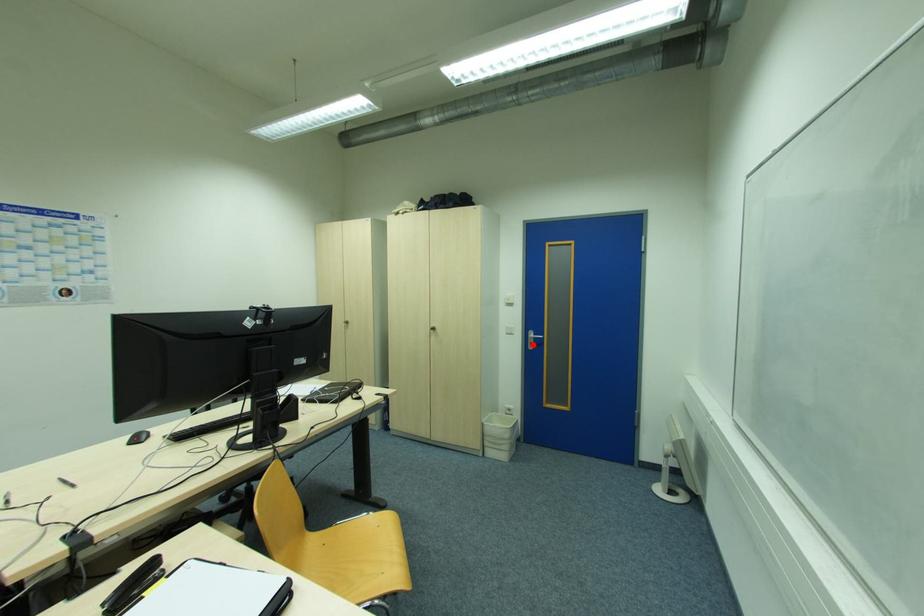
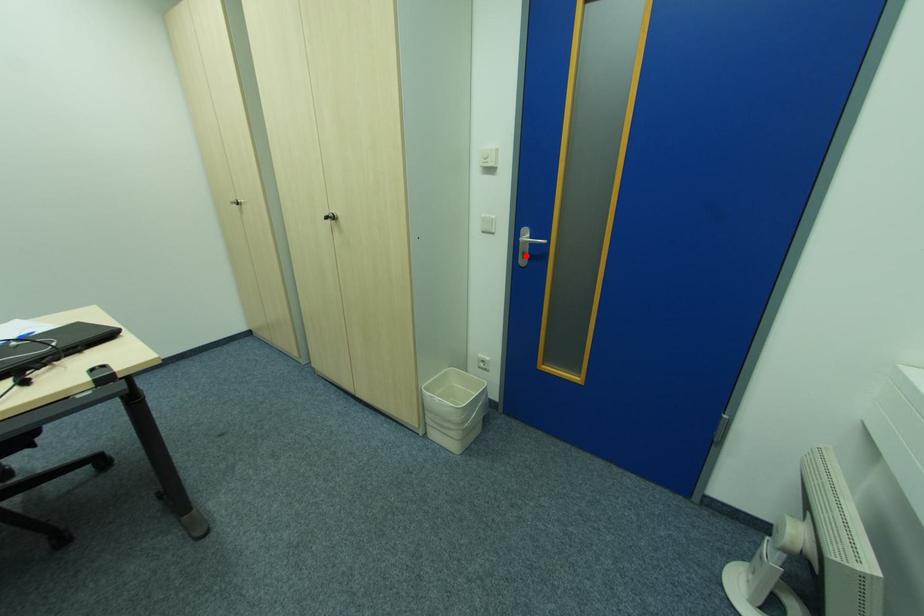
I am providing you with two images of the same scene from different viewpoints. A red point is marked on the first image and another point is marked on the second image. Are the points marked in image1 and image2 representing the same 3D position?

Yes